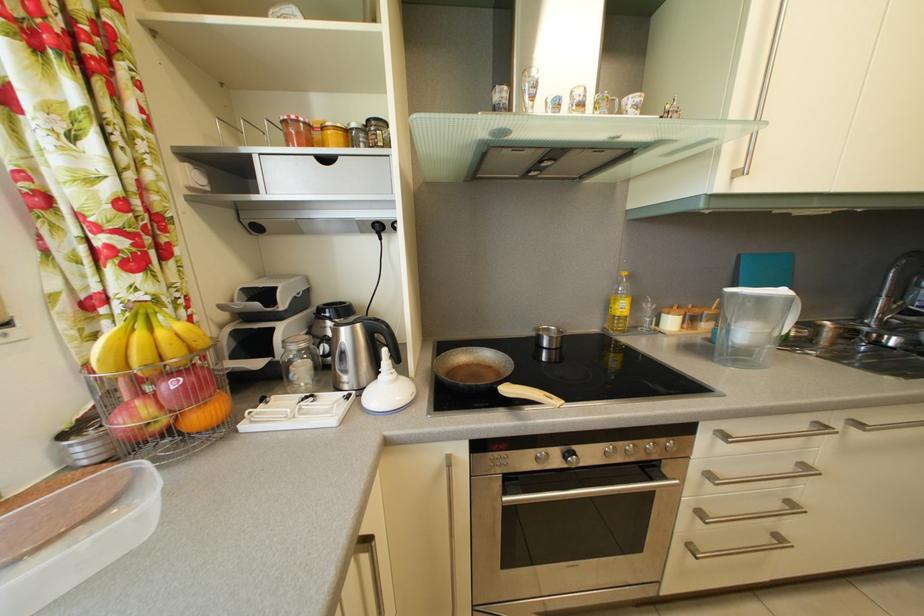
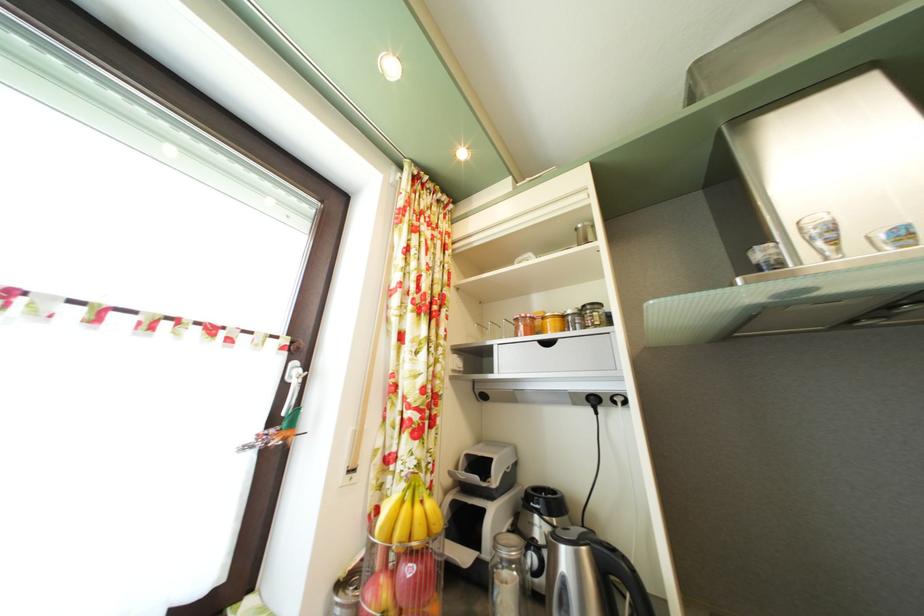
In the second image, find the point that corresponds to point 514,95 in the first image.

(781, 252)